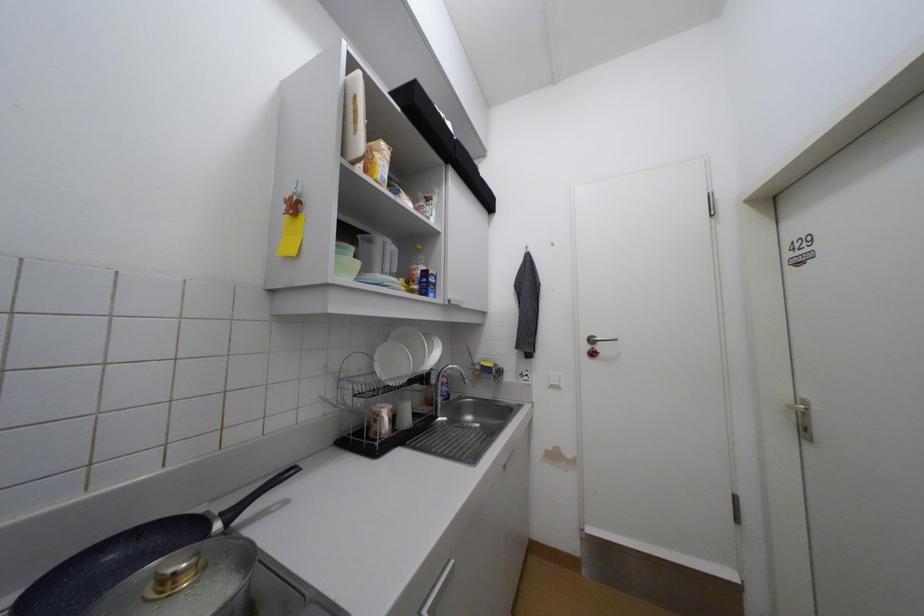
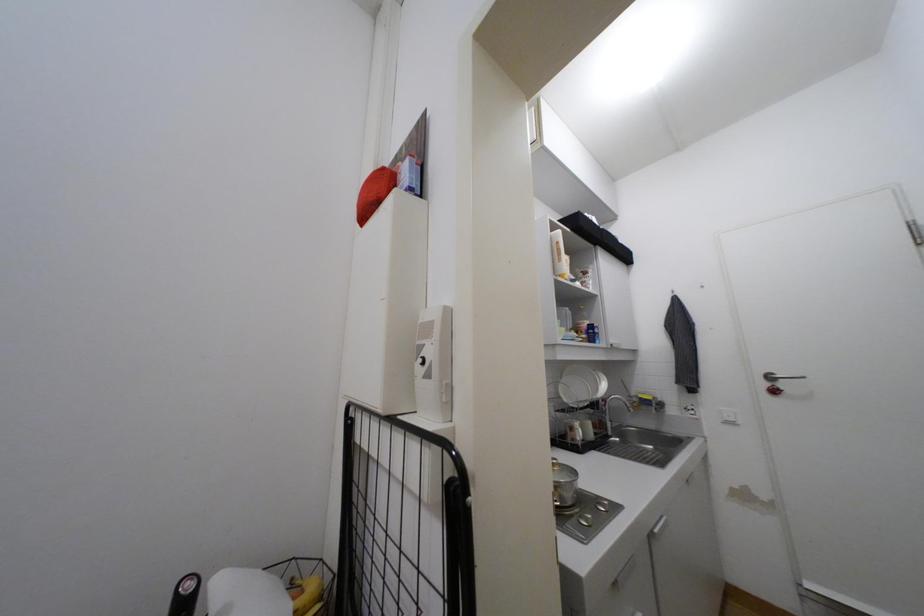
Question: How did the camera likely rotate?

Choices:
 (A) Left
 (B) Right
 (C) Up
 (D) Down

Answer: (A)